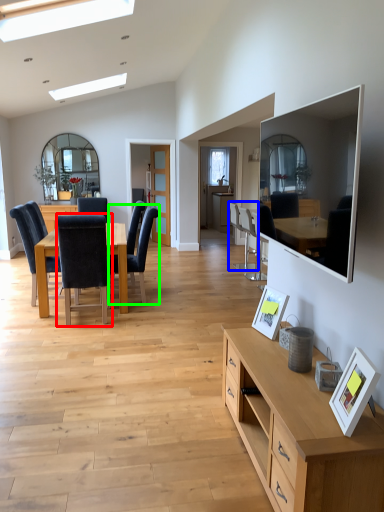
Question: Which is farther away from chair (highlighted by a red box)? chair (highlighted by a blue box) or chair (highlighted by a green box)?

Choices:
 (A) chair
 (B) chair

Answer: (A)